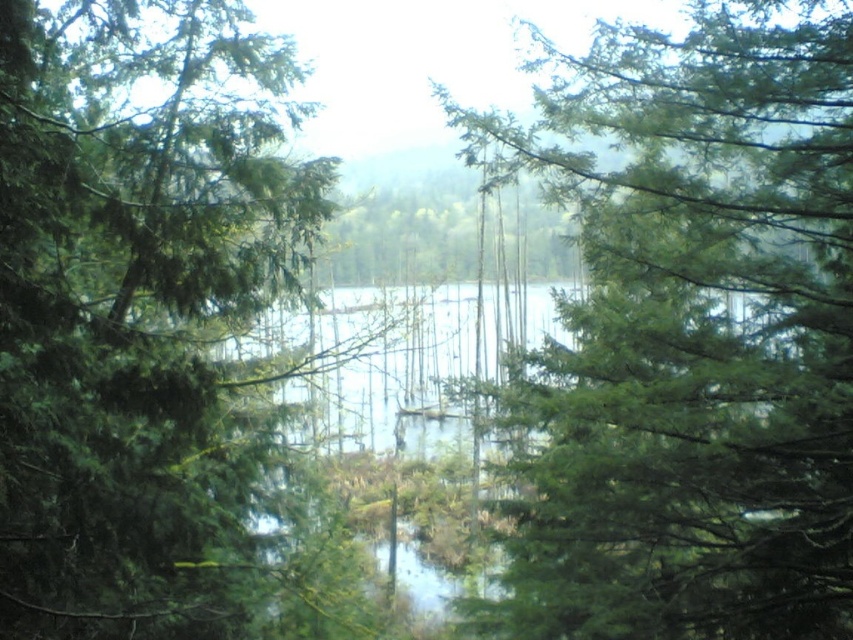
Which of these two, green leafy tree at center or green matte tree at left, stands taller?

Standing taller between the two is green leafy tree at center.

Is green leafy tree at center smaller than green matte tree at left?

No, green leafy tree at center is not smaller than green matte tree at left.

Does point (640, 230) come in front of point (297, 120)?

No.

Locate an element on the screen. The height and width of the screenshot is (640, 853). green leafy tree at center is located at coordinates (691, 333).